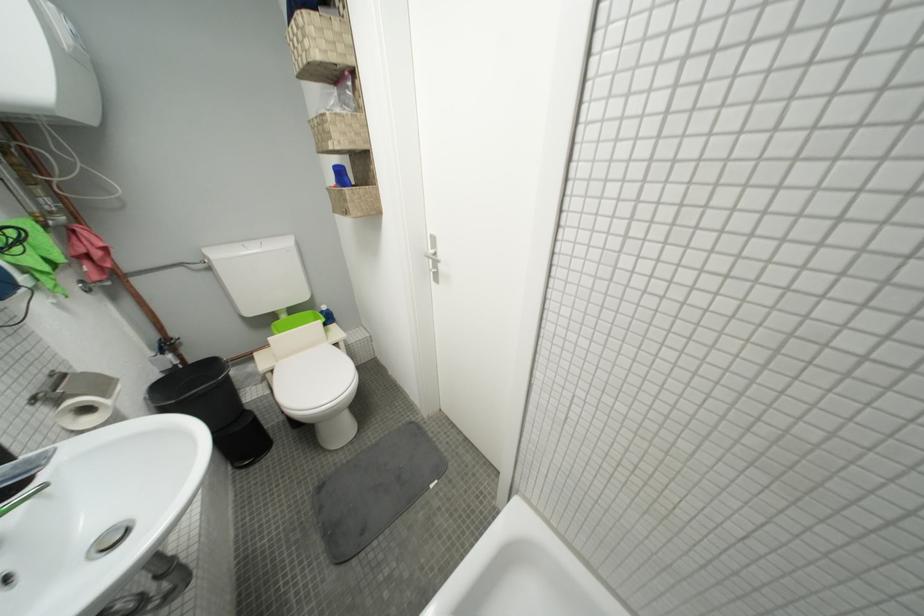
What do you see at coordinates (313, 383) in the screenshot?
I see `the white toilet seat` at bounding box center [313, 383].